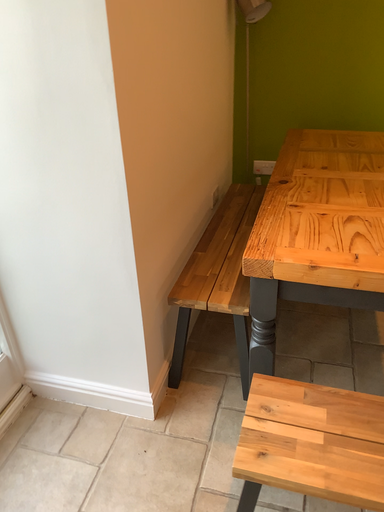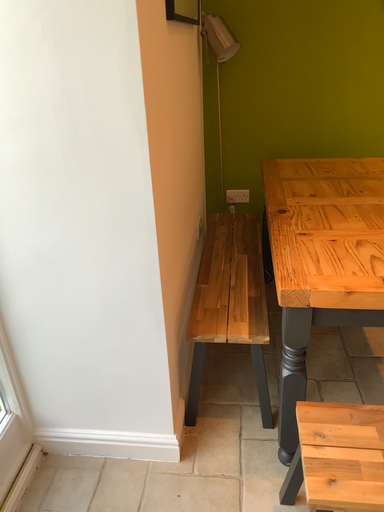
Question: How did the camera likely rotate when shooting the video?

Choices:
 (A) rotated right
 (B) rotated left

Answer: (A)